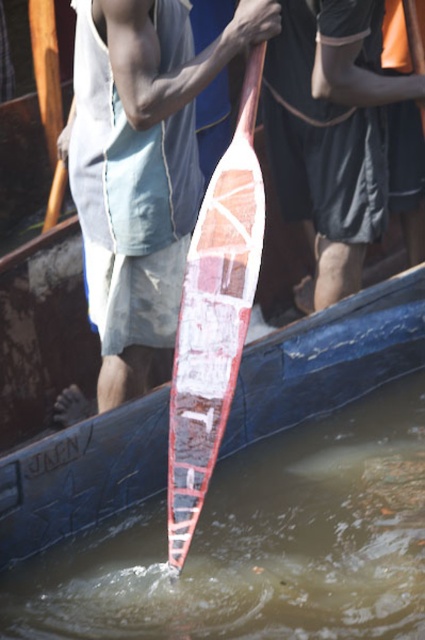
Question: Estimate the real-world distances between objects in this image. Which object is farther from the wooden surfboard at center?

Choices:
 (A) translucent water at paddle center
 (B) matte white paddle at center

Answer: (A)

Question: Estimate the real-world distances between objects in this image. Which object is closer to the matte white paddle at center?

Choices:
 (A) wooden surfboard at center
 (B) translucent water at paddle center
 (C) wooden paddle at center

Answer: (A)

Question: Which point is closer to the camera taking this photo?

Choices:
 (A) (224, 193)
 (B) (56, 124)

Answer: (A)

Question: Does translucent water at paddle center come in front of matte white paddle at center?

Choices:
 (A) yes
 (B) no

Answer: (B)

Question: Does matte white paddle at center have a lesser width compared to wooden surfboard at center?

Choices:
 (A) yes
 (B) no

Answer: (B)

Question: Does translucent water at paddle center have a smaller size compared to wooden paddle at center?

Choices:
 (A) no
 (B) yes

Answer: (A)